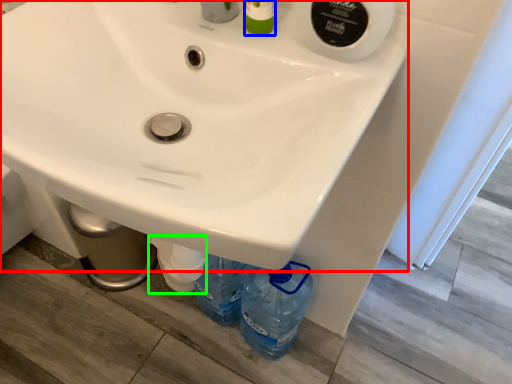
Question: Considering the real-world distances, which object is closest to sink (highlighted by a red box)? toiletry (highlighted by a blue box) or bottle (highlighted by a green box).

Choices:
 (A) toiletry
 (B) bottle

Answer: (A)